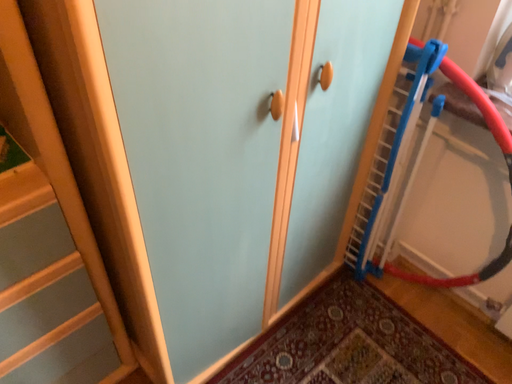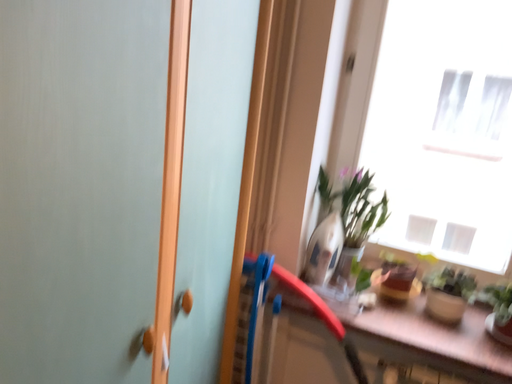
Question: How did the camera likely rotate when shooting the video?

Choices:
 (A) rotated downward
 (B) rotated upward

Answer: (B)